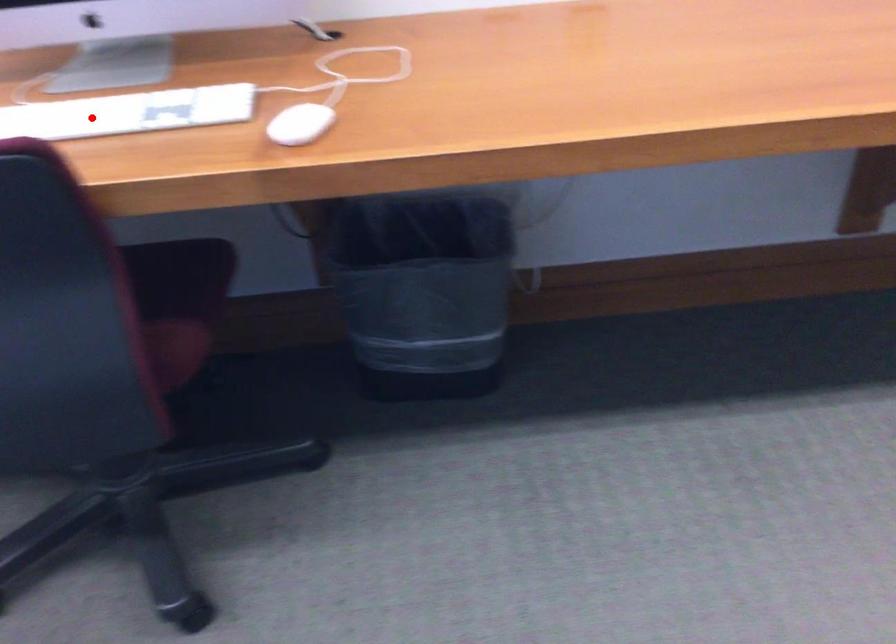
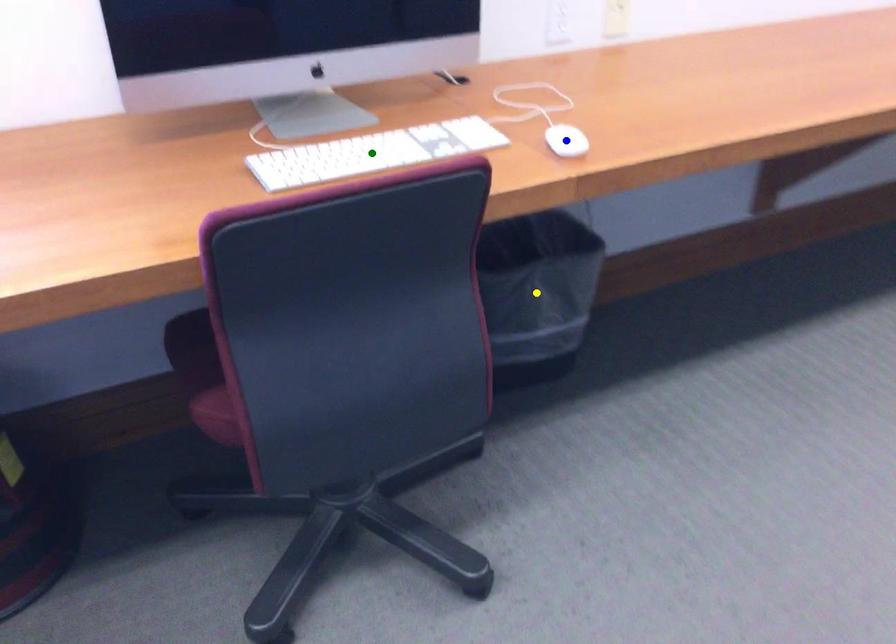
Question: I am providing you with two images of the same scene from different viewpoints. A red point is marked on the first image. You are given multiple points on the second image. Which mark in image 2 goes with the point in image 1?

Choices:
 (A) yellow point
 (B) green point
 (C) blue point

Answer: (B)